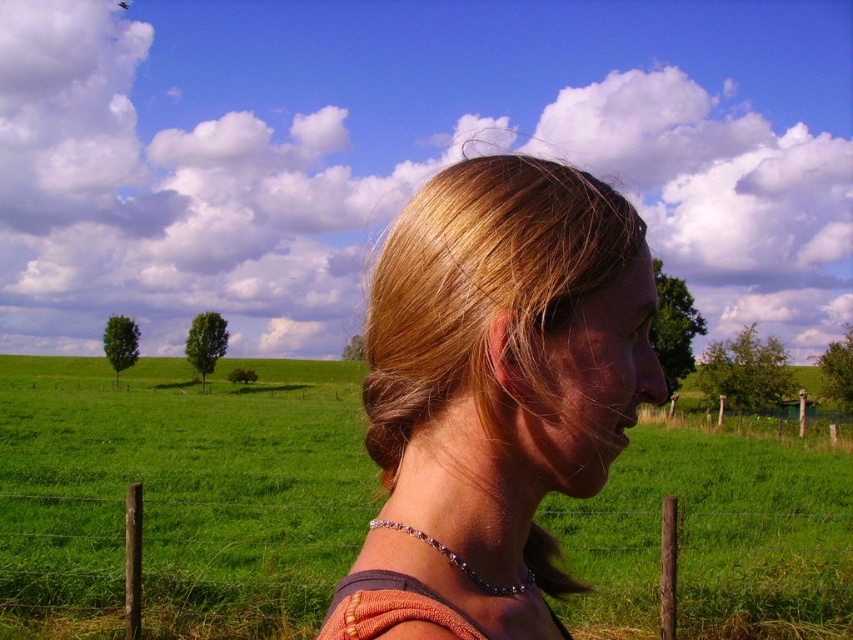
You are an artist trying to sketch this scene. You want to ensure the blonde hair at center and the wooden post at lower right are proportionally accurate. Which object should you draw smaller in your sketch?

The blonde hair at center should be drawn smaller than the wooden post at lower right because the blonde hair at center has a smaller size compared to wooden post at lower right.

You are a photographer trying to capture the scene with a camera. You notice the blonde hair at center and the wooden post at lower right. Which object has a smaller width when viewed from your position?

The blonde hair at center has a smaller width than the wooden post at lower right, so it is the narrower object between the two.